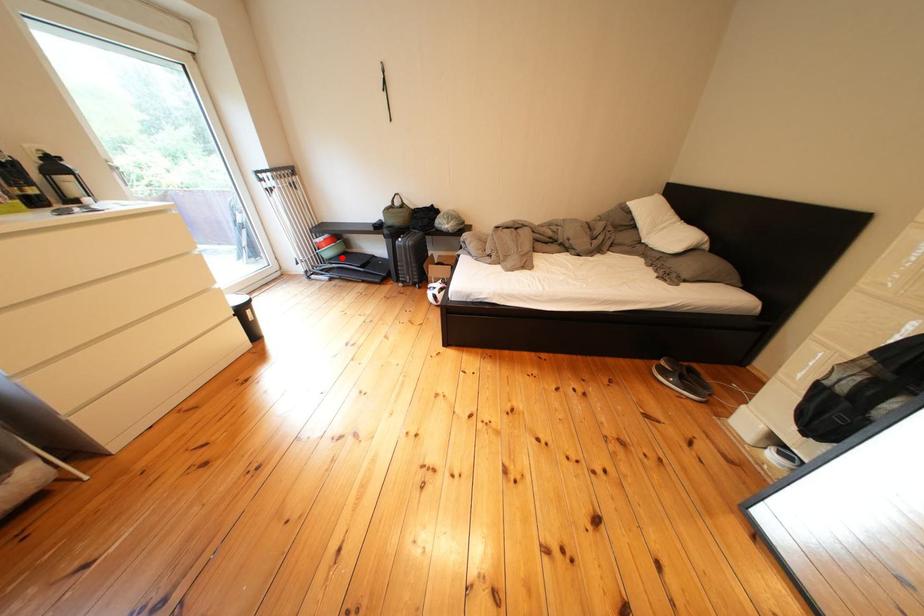
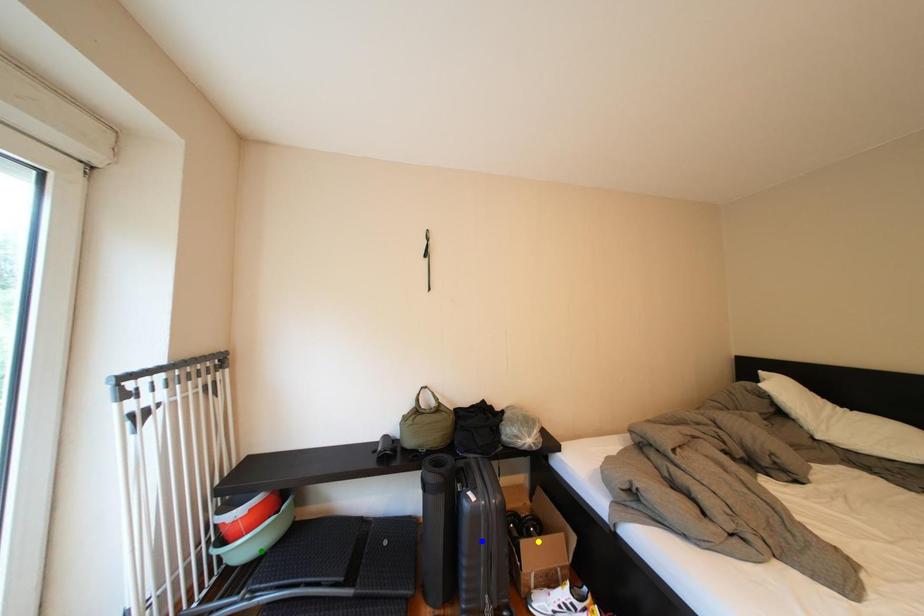
Question: I am providing you with two images of the same scene from different viewpoints. A red point is marked on the first image. You are given multiple points on the second image. Which mark in image 2 goes with the point in image 1?

Choices:
 (A) blue point
 (B) green point
 (C) yellow point

Answer: (B)